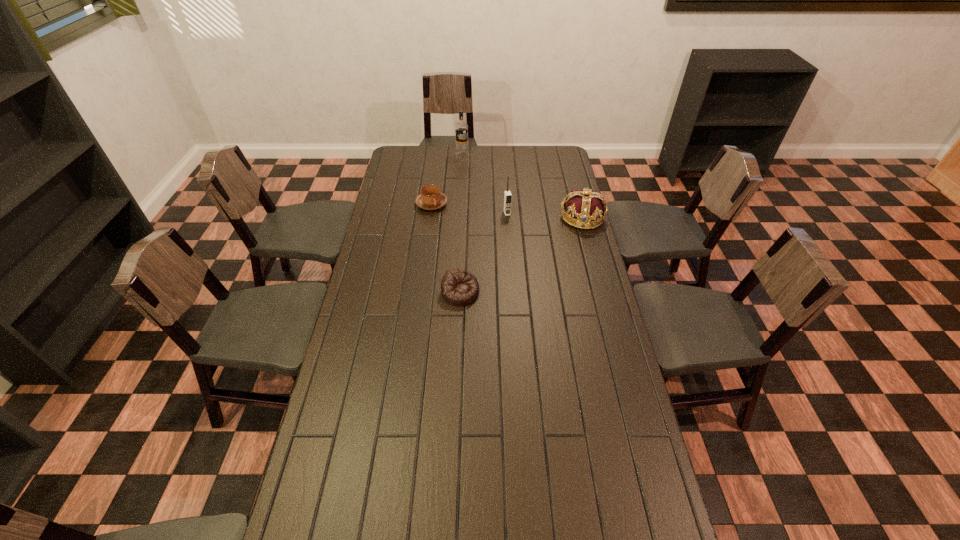
The image size is (960, 540). I want to click on free region that satisfies the following two spatial constraints: 1. on the back side of the beanbag; 2. on the right side of the second object from right to left, so click(x=464, y=213).